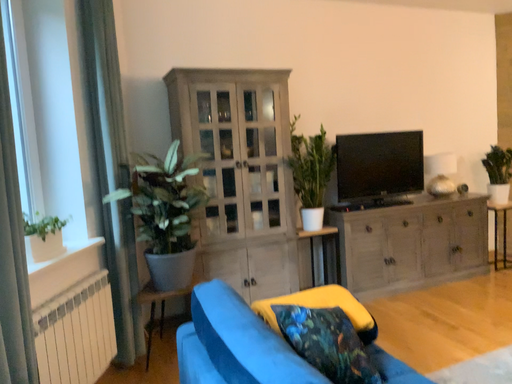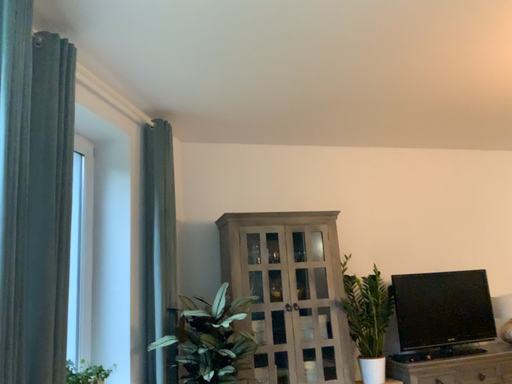
Question: How did the camera likely rotate when shooting the video?

Choices:
 (A) rotated upward
 (B) rotated downward

Answer: (A)